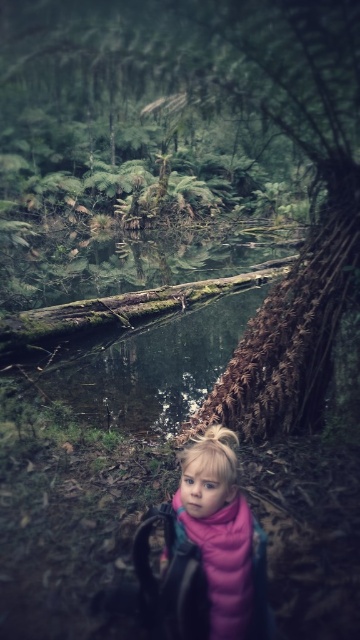
Question: Is the position of brown textured log at center more distant than that of pink fleece jacket at center?

Choices:
 (A) yes
 (B) no

Answer: (A)

Question: Can you confirm if brown textured log at center is positioned to the left of pink fleece jacket at center?

Choices:
 (A) no
 (B) yes

Answer: (A)

Question: Is brown textured log at center smaller than pink fleece jacket at center?

Choices:
 (A) yes
 (B) no

Answer: (B)

Question: Which of the following is the farthest from the observer?

Choices:
 (A) pink fleece jacket at center
 (B) brown textured log at center

Answer: (B)

Question: Among these points, which one is nearest to the camera?

Choices:
 (A) (106, 58)
 (B) (201, 472)

Answer: (B)